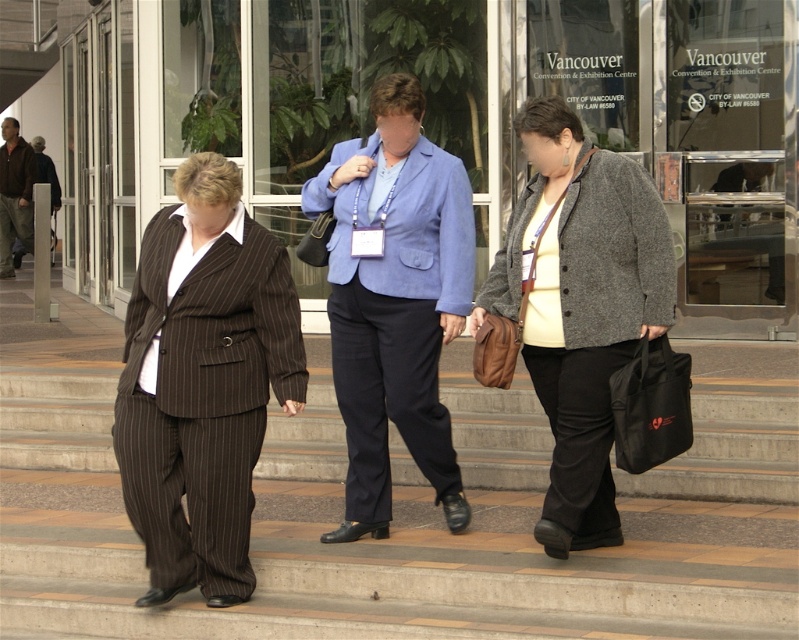
You are standing at the bottom of the stairs leading to the Vancouver Convention Centre. You see two points marked on the stairs. The first point is at coordinate point (x=142, y=525) and the second is at point (x=372, y=323). Which point is closer to you?

Point (x=142, y=525) is closer to the viewer than point (x=372, y=323).

You are standing at the top of the stairs looking down. You see the brown pinstripe suit at center and the blue fabric business suit at center. Which one is closer to you?

The brown pinstripe suit at center is closer to you because it is positioned below the blue fabric business suit at center, meaning it is lower on the stairs and therefore nearer to your vantage point at the top.